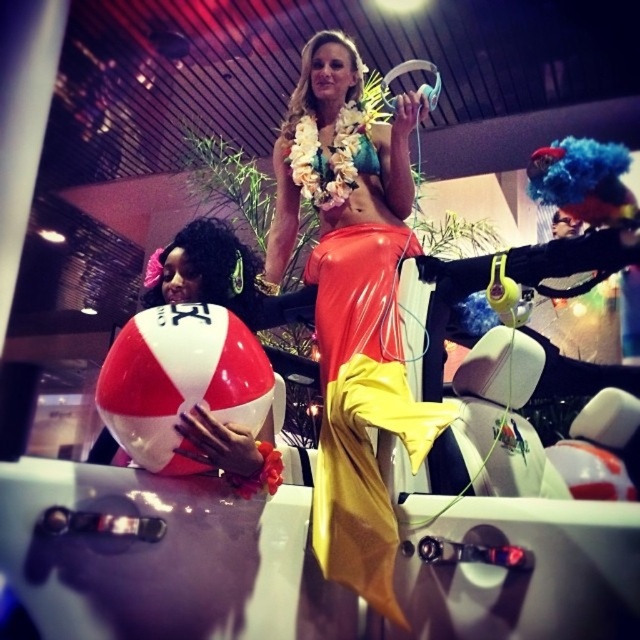
You are at a beach party and want to take a photo with the shiny orange latex dress at center and the blue fuzzy wig at upper right. Which object should you point your camera towards first if you want to capture both in the frame?

You should point your camera towards the shiny orange latex dress at center first because it is located below the blue fuzzy wig at upper right, so capturing it first ensures both objects are in the frame.

You are standing in the scene and want to take a photo of both point (342, 564) and point (204, 339). Which point will appear larger in the photo?

Point (342, 564) is closer to the camera than point (204, 339), so it will appear larger in the photo.